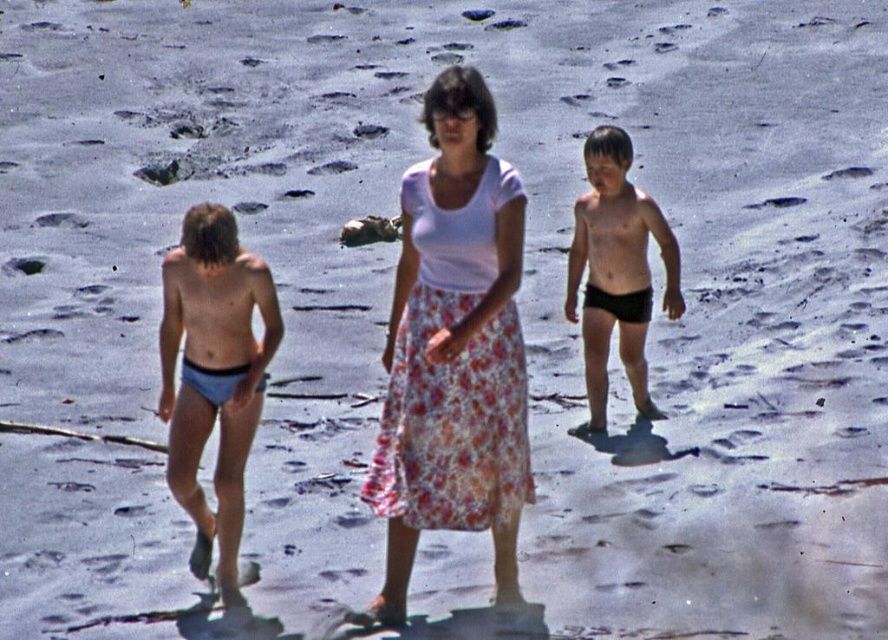
Based on the photo, you are a photographer trying to capture a photo of the beach scene. You notice the white floral skirt at center and the black matte shorts at right. Which object should you focus on to ensure it appears larger in your photo?

The white floral skirt at center is much taller than the black matte shorts at right, so focusing on the white floral skirt at center will make it appear larger in the photo.

You are standing at the point with coordinates 0.6, 0.6. You want to walk to the white floral skirt at center. In which direction should you move?

Since the white floral skirt at center is located at point (453,348) and you are at (532,384), you should move southwest to reach it.